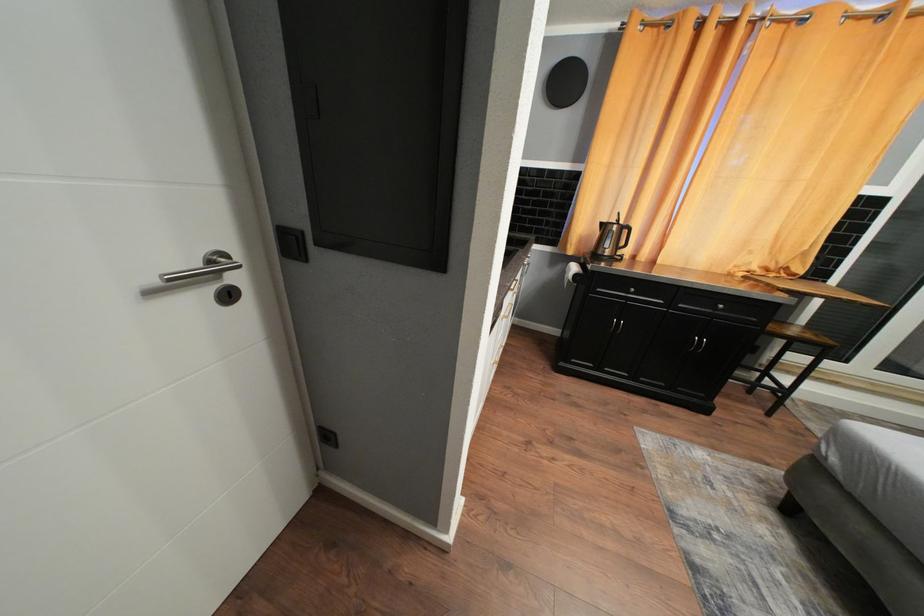
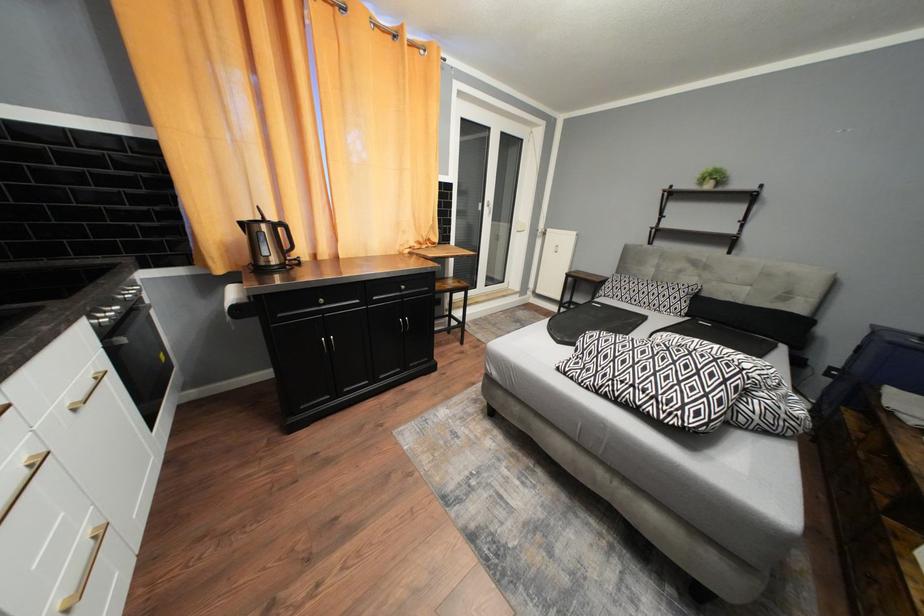
Question: How did the camera likely rotate?

Choices:
 (A) Left
 (B) Right
 (C) Up
 (D) Down

Answer: (B)